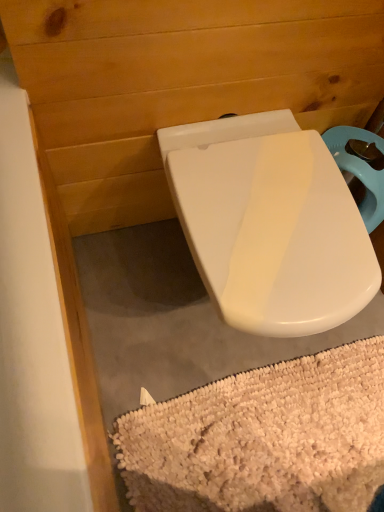
Measure the distance between point (251, 153) and camera.

Point (251, 153) is 89.10 centimeters away from camera.

Find the location of a particular element. white glossy toilet seat at center is located at coordinates (270, 223).

Describe the element at coordinates (270, 223) in the screenshot. This screenshot has height=512, width=384. I see `white glossy toilet seat at center` at that location.

In order to face white shaggy bath mat at lower center, should I rotate leftwards or rightwards?

To face it directly, rotate right by 12.925 degrees.

This screenshot has width=384, height=512. Find the location of `white shaggy bath mat at lower center`. white shaggy bath mat at lower center is located at coordinates (263, 438).

What do you see at coordinates (263, 438) in the screenshot? I see `white shaggy bath mat at lower center` at bounding box center [263, 438].

Locate an element on the screen. Image resolution: width=384 pixels, height=512 pixels. white glossy toilet seat at center is located at coordinates (270, 223).

Can you confirm if white shaggy bath mat at lower center is positioned to the left of white glossy toilet seat at center?

No.

Does white shaggy bath mat at lower center come behind white glossy toilet seat at center?

Yes, it is behind white glossy toilet seat at center.

Is point (217, 402) positioned after point (284, 322)?

That is True.

Based on the photo, from the image's perspective, does white shaggy bath mat at lower center appear higher than white glossy toilet seat at center?

No, from the image's perspective, white shaggy bath mat at lower center is not above white glossy toilet seat at center.

From a real-world perspective, does white shaggy bath mat at lower center sit lower than white glossy toilet seat at center?

Indeed, from a real-world perspective, white shaggy bath mat at lower center is positioned beneath white glossy toilet seat at center.

Between white shaggy bath mat at lower center and white glossy toilet seat at center, which one has smaller width?

white shaggy bath mat at lower center.

In terms of height, does white shaggy bath mat at lower center look taller or shorter compared to white glossy toilet seat at center?

Considering their sizes, white shaggy bath mat at lower center has less height than white glossy toilet seat at center.

Considering the sizes of white shaggy bath mat at lower center and white glossy toilet seat at center in the image, is white shaggy bath mat at lower center bigger or smaller than white glossy toilet seat at center?

In the image, white shaggy bath mat at lower center appears to be smaller than white glossy toilet seat at center.

Is white shaggy bath mat at lower center located outside white glossy toilet seat at center?

Indeed, white shaggy bath mat at lower center is completely outside white glossy toilet seat at center.

Is white shaggy bath mat at lower center positioned far away from white glossy toilet seat at center?

They are positioned close to each other.

Is white shaggy bath mat at lower center facing towards white glossy toilet seat at center?

No, white shaggy bath mat at lower center is not turned towards white glossy toilet seat at center.

Can you tell me how much white shaggy bath mat at lower center and white glossy toilet seat at center differ in facing direction?

white shaggy bath mat at lower center and white glossy toilet seat at center are facing 0.573 degrees away from each other.

How far apart are white shaggy bath mat at lower center and white glossy toilet seat at center?

A distance of 18.95 inches exists between white shaggy bath mat at lower center and white glossy toilet seat at center.

Find the location of a particular element. The width and height of the screenshot is (384, 512). toilet in front of the white shaggy bath mat at lower center is located at coordinates (270, 223).

Which object is positioned more to the right, white glossy toilet seat at center or white shaggy bath mat at lower center?

From the viewer's perspective, white shaggy bath mat at lower center appears more on the right side.

Which object is more forward, white glossy toilet seat at center or white shaggy bath mat at lower center?

white glossy toilet seat at center is closer to the camera.

Is point (203, 146) farther from camera compared to point (212, 404)?

No, it is in front of (212, 404).

From the image's perspective, would you say white glossy toilet seat at center is positioned over white shaggy bath mat at lower center?

Yes, from the image's perspective, white glossy toilet seat at center is on top of white shaggy bath mat at lower center.

From a real-world perspective, which object stands above the other?

white glossy toilet seat at center.

Looking at this image, can you confirm if white glossy toilet seat at center is wider than white shaggy bath mat at lower center?

Yes, white glossy toilet seat at center is wider than white shaggy bath mat at lower center.

Who is taller, white glossy toilet seat at center or white shaggy bath mat at lower center?

white glossy toilet seat at center.

Is white glossy toilet seat at center bigger or smaller than white shaggy bath mat at lower center?

In the image, white glossy toilet seat at center appears to be larger than white shaggy bath mat at lower center.

Is white glossy toilet seat at center not within white shaggy bath mat at lower center?

That's correct, white glossy toilet seat at center is outside of white shaggy bath mat at lower center.

Is white glossy toilet seat at center not near white shaggy bath mat at lower center?

No, white glossy toilet seat at center is not far away from white shaggy bath mat at lower center.

Is white glossy toilet seat at center oriented towards white shaggy bath mat at lower center?

Yes, white glossy toilet seat at center is oriented towards white shaggy bath mat at lower center.

Can you tell me how much white glossy toilet seat at center and white shaggy bath mat at lower center differ in facing direction?

white glossy toilet seat at center and white shaggy bath mat at lower center are facing 0.573 degrees away from each other.

Locate an element on the screen. This screenshot has height=512, width=384. toilet that is in front of the white shaggy bath mat at lower center is located at coordinates (270, 223).

Identify the location of bath mat beneath the white glossy toilet seat at center (from a real-world perspective). This screenshot has height=512, width=384. (263, 438).

The height and width of the screenshot is (512, 384). Find the location of `bath mat on the right of white glossy toilet seat at center`. bath mat on the right of white glossy toilet seat at center is located at coordinates (263, 438).